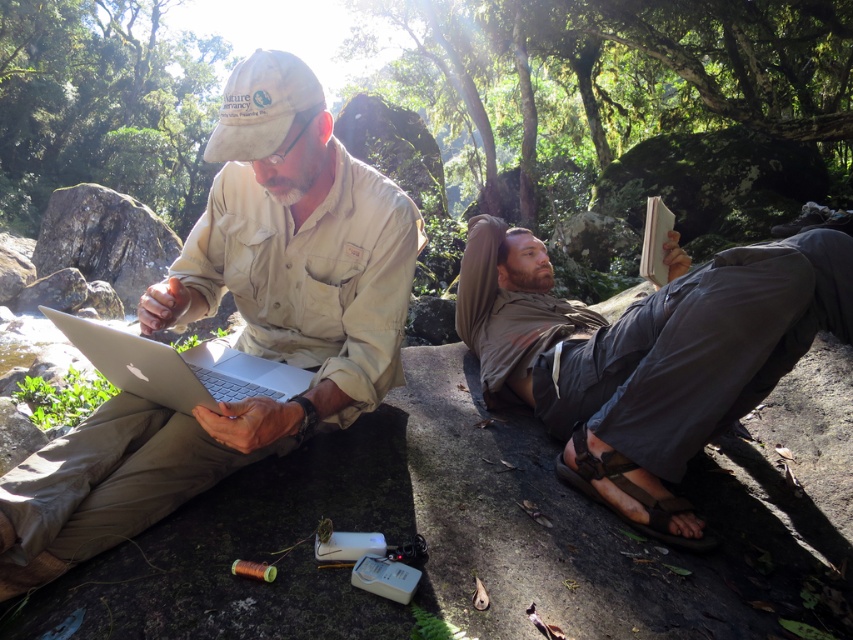
You are a hiker who needs to pack your backpack. You have both the khaki cotton pants at center and the silver metallic laptop at center. Which item takes up more space in your backpack?

The khaki cotton pants at center takes up more space in the backpack because its width is larger than the silver metallic laptop at center.

You are standing at the camera position and want to reach point (247, 340). Is the distance more than 5 feet?

Yes, the distance between the camera and point (247, 340) is 5.58 feet, which is more than 5 feet.

You are a photographer trying to capture a closeup of the matte khaki shirt at center and the brown leather sandal at lower center in the scene. Your camera can only focus on objects within a 30 inch range. Can both objects be in focus at the same time?

The matte khaki shirt at center is 34.17 inches from the brown leather sandal at lower center. Since the distance between them exceeds the camera focus range of 30 inches, both objects cannot be in focus simultaneously.